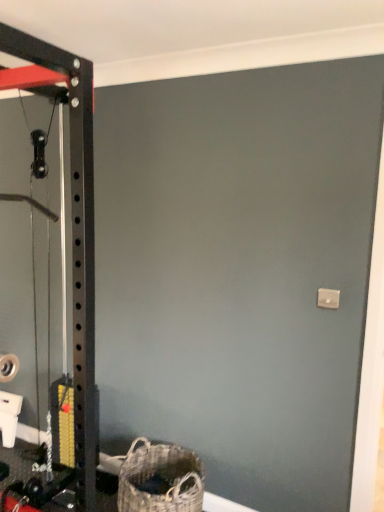
The height and width of the screenshot is (512, 384). What do you see at coordinates (160, 474) in the screenshot?
I see `woven brown basket at lower center` at bounding box center [160, 474].

Locate an element on the screen. This screenshot has width=384, height=512. woven brown basket at lower center is located at coordinates (160, 474).

The width and height of the screenshot is (384, 512). I want to click on woven brown basket at lower center, so click(160, 474).